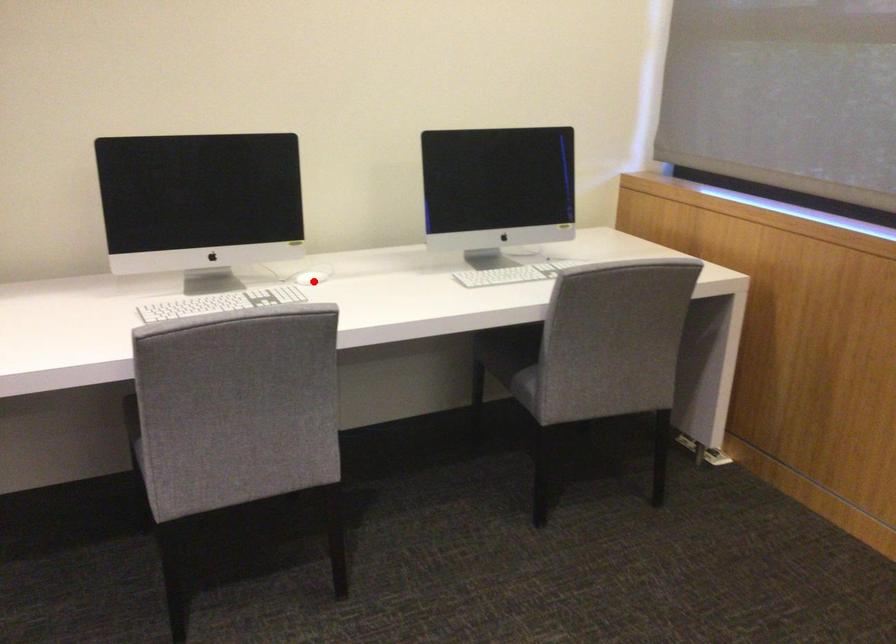
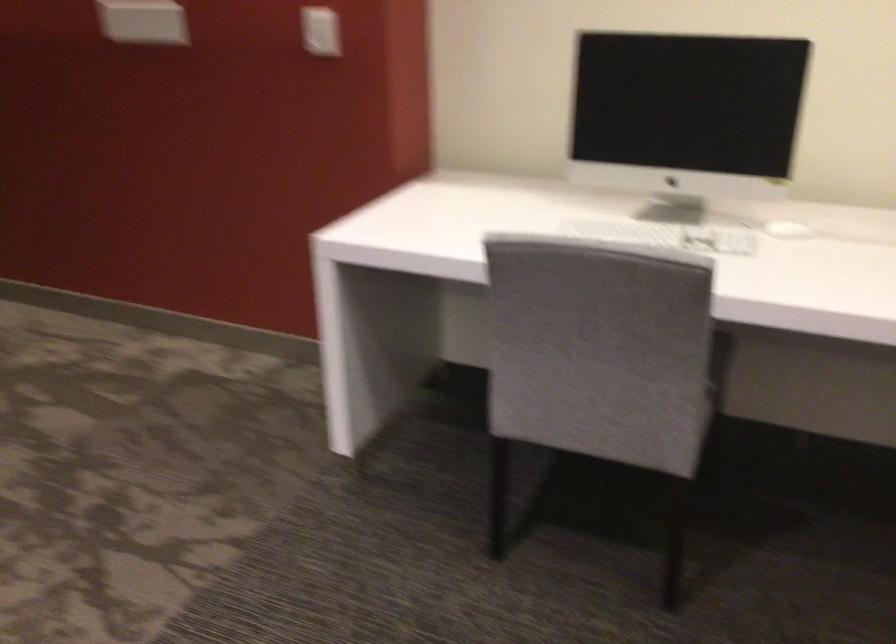
Locate, in the second image, the point that corresponds to the highlighted location in the first image.

(786, 230)